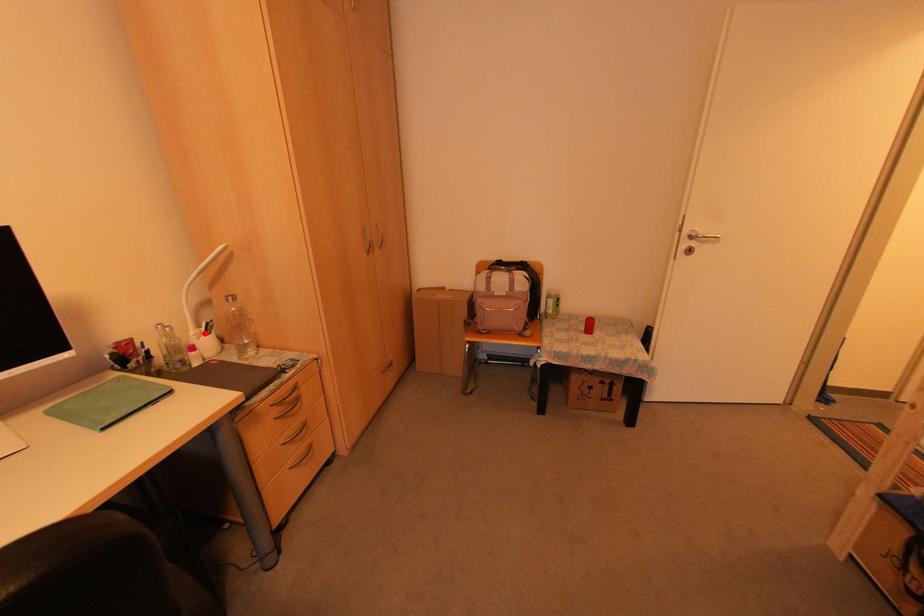
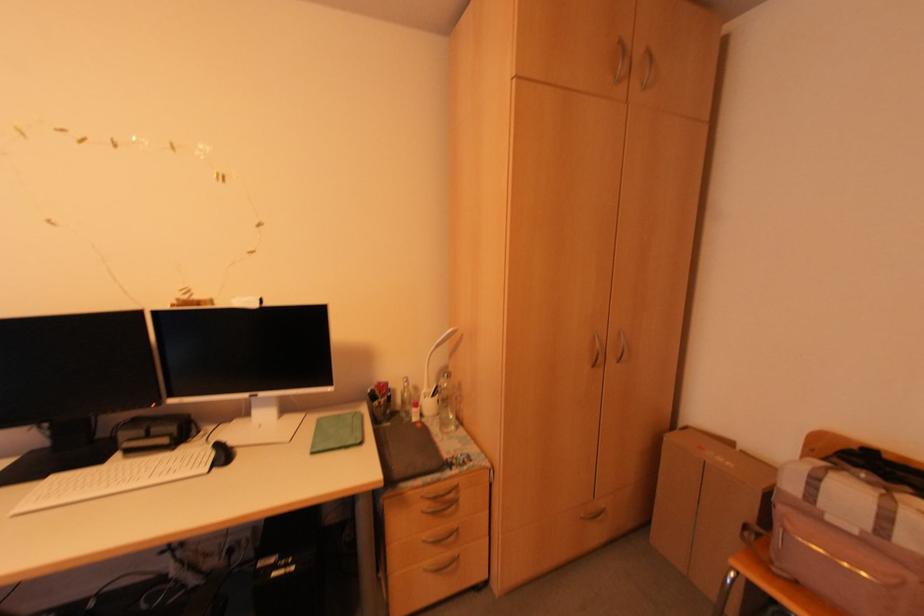
Question: I am providing you with two images of the same scene from different viewpoints. Given a red point in image1, look at the same physical point in image2. Is it:

Choices:
 (A) Closer to the viewpoint
 (B) Farther from the viewpoint

Answer: (B)